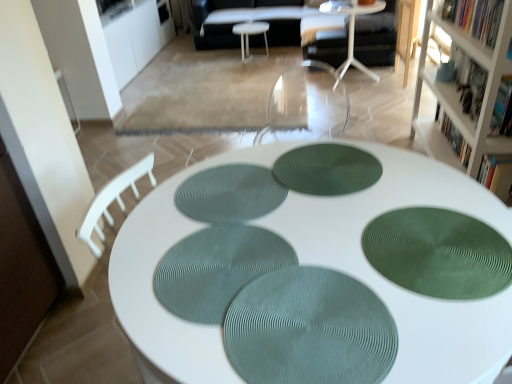
What are the coordinates of `vacant area on the back side of green textured mat at lower right, marked as the first mat in a right-to-left arrangement` in the screenshot? It's located at (386, 187).